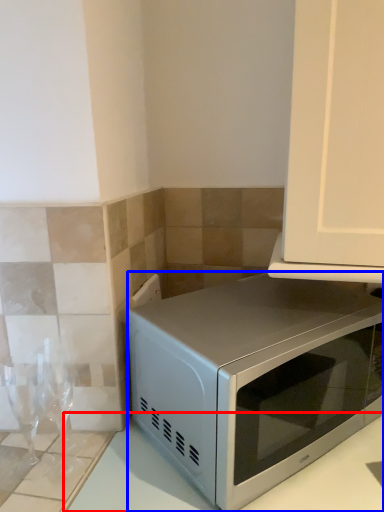
Question: Which point is further to the camera, counter top (highlighted by a red box) or microwave oven (highlighted by a blue box)?

Choices:
 (A) counter top
 (B) microwave oven

Answer: (B)